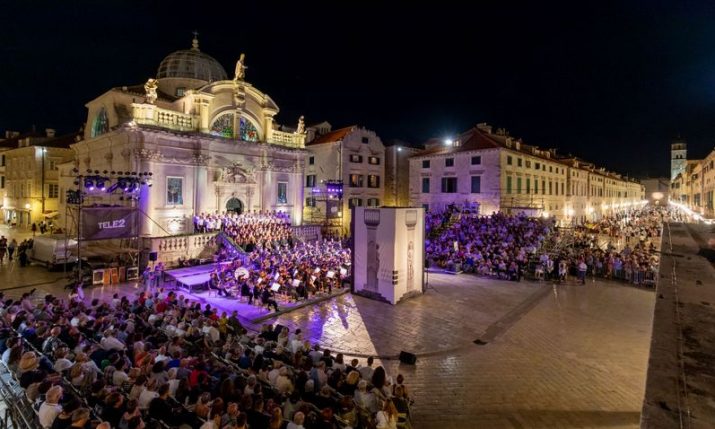
Locate an element on the screen. corner is located at coordinates pyautogui.click(x=701, y=419), pyautogui.click(x=9, y=417), pyautogui.click(x=13, y=8), pyautogui.click(x=701, y=12).